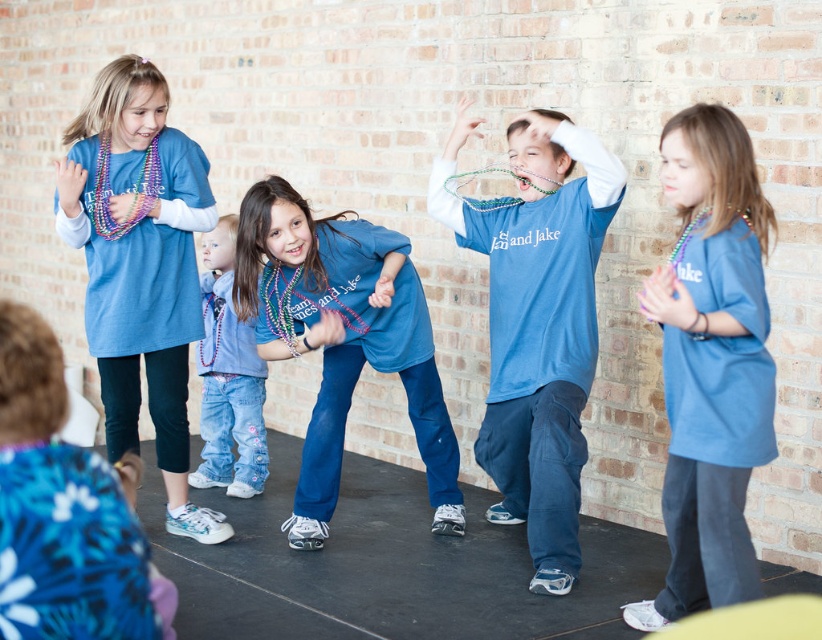
You are a photographer trying to capture a group photo of the children wearing the matte blue shirts. You notice two children wearing the matte blue shirt at right and the matte blue shirt at center. Which child should you position on the left side to ensure they are aligned properly?

The matte blue shirt at center should be positioned on the left side because the matte blue shirt at right is currently on its right side, so moving the center one to the left would align them correctly.